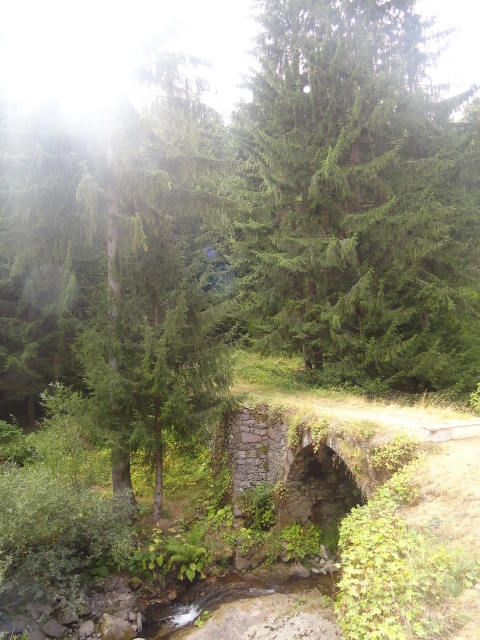
You are hiking in the forest and want to cross the rusty stone bridge at center. There is a green matte tree at center blocking your path. Which direction should you move to go around the tree and reach the bridge?

Since the green matte tree at center is to the left of the rusty stone bridge at center, you should move to the right of the tree to reach the bridge.